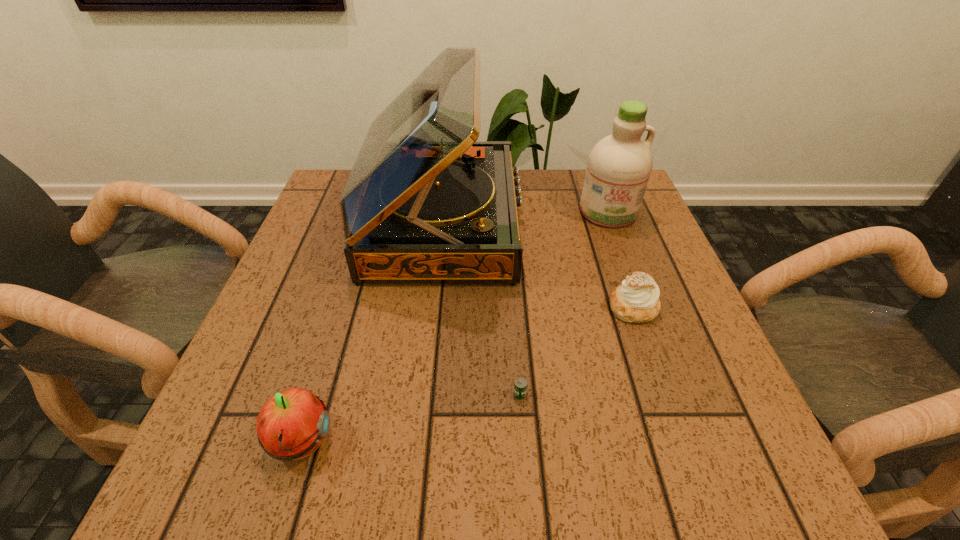
Where is `vacant space in between the beer can and the fourth tallest object`? The height and width of the screenshot is (540, 960). vacant space in between the beer can and the fourth tallest object is located at coordinates (577, 350).

This screenshot has height=540, width=960. I want to click on free space between the cleansing agent and the third tallest object, so click(454, 327).

I want to click on free space that is in between the tallest object and the beer can, so click(x=481, y=308).

This screenshot has height=540, width=960. In order to click on unoccupied area between the second shortest object and the tallest object in this screenshot , I will do `click(538, 265)`.

This screenshot has height=540, width=960. Find the location of `free space between the record player and the apple`. free space between the record player and the apple is located at coordinates (372, 332).

Locate an element on the screen. The width and height of the screenshot is (960, 540). vacant area that lies between the third nearest object and the second tallest object is located at coordinates (621, 260).

This screenshot has height=540, width=960. I want to click on vacant region between the second tallest object and the third farthest object, so click(x=621, y=260).

Where is `object that can be found as the third closest to the third farthest object`? Image resolution: width=960 pixels, height=540 pixels. object that can be found as the third closest to the third farthest object is located at coordinates (619, 166).

Where is `the third closest object to the beer can`? the third closest object to the beer can is located at coordinates point(291,425).

This screenshot has height=540, width=960. I want to click on free space in the image that satisfies the following two spatial constraints: 1. on the front label of the cleansing agent; 2. on the front-facing side of the record player, so click(612, 222).